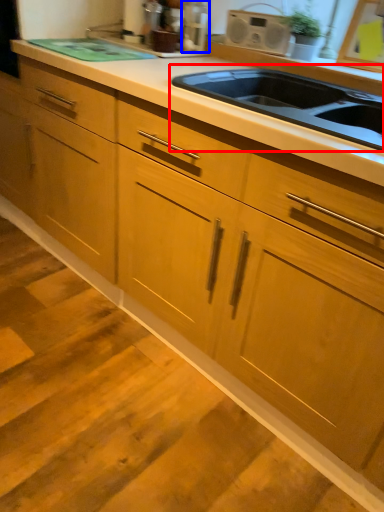
Question: Which of the following is the farthest to the observer, sink (highlighted by a red box) or appliance (highlighted by a blue box)?

Choices:
 (A) sink
 (B) appliance

Answer: (B)